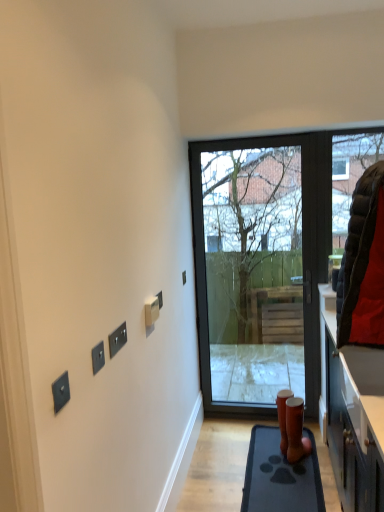
Locate an element on the screen. The width and height of the screenshot is (384, 512). free location in front of brown matte vase at lower center is located at coordinates (313, 468).